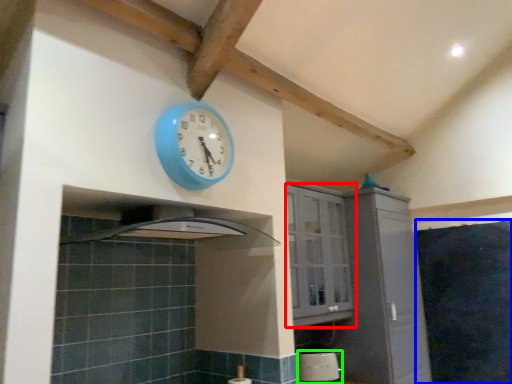
Question: Considering the real-world distances, which object is farthest from cabinetry (highlighted by a red box)? dark (highlighted by a blue box) or appliance (highlighted by a green box)?

Choices:
 (A) dark
 (B) appliance

Answer: (A)